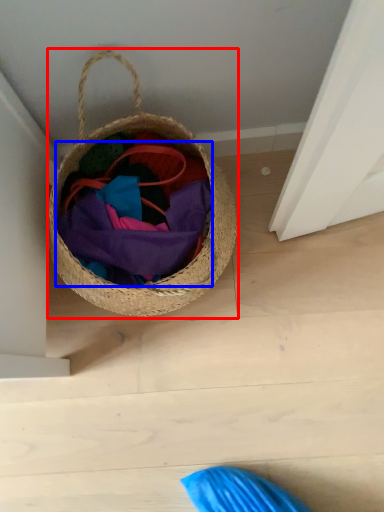
Question: Among these objects, which one is farthest to the camera, picnic basket (highlighted by a red box) or bag (highlighted by a blue box)?

Choices:
 (A) picnic basket
 (B) bag

Answer: (B)